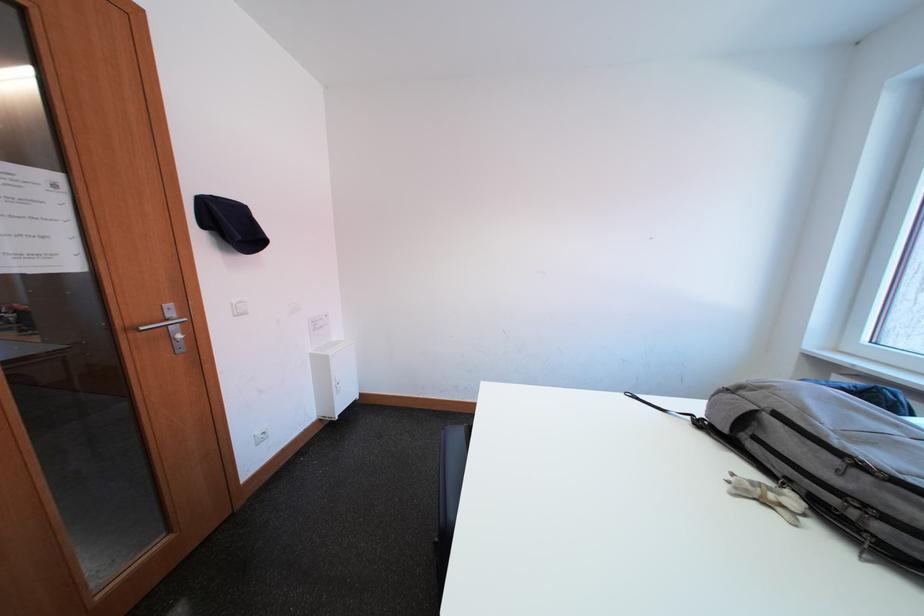
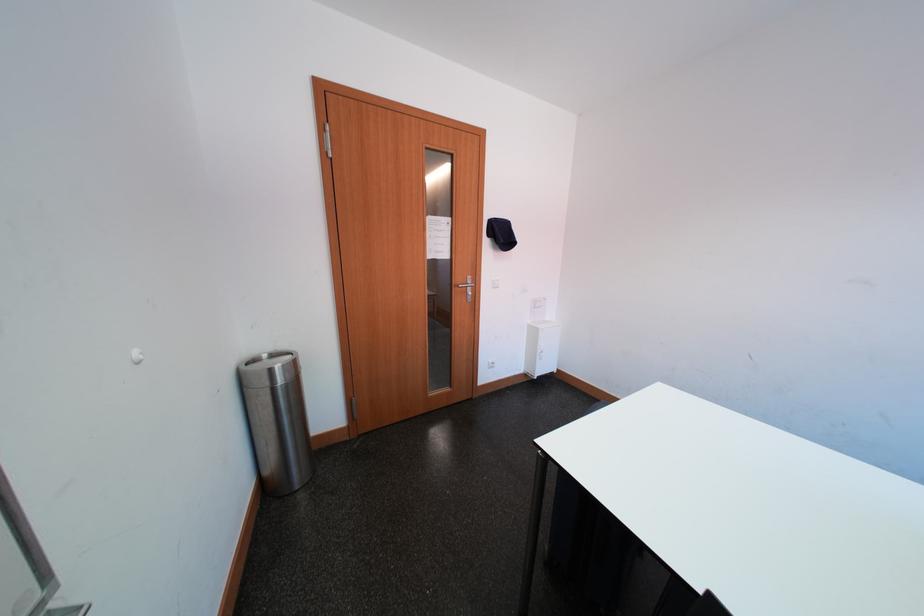
Locate, in the second image, the point that corresponds to (139,317) in the first image.

(467, 283)